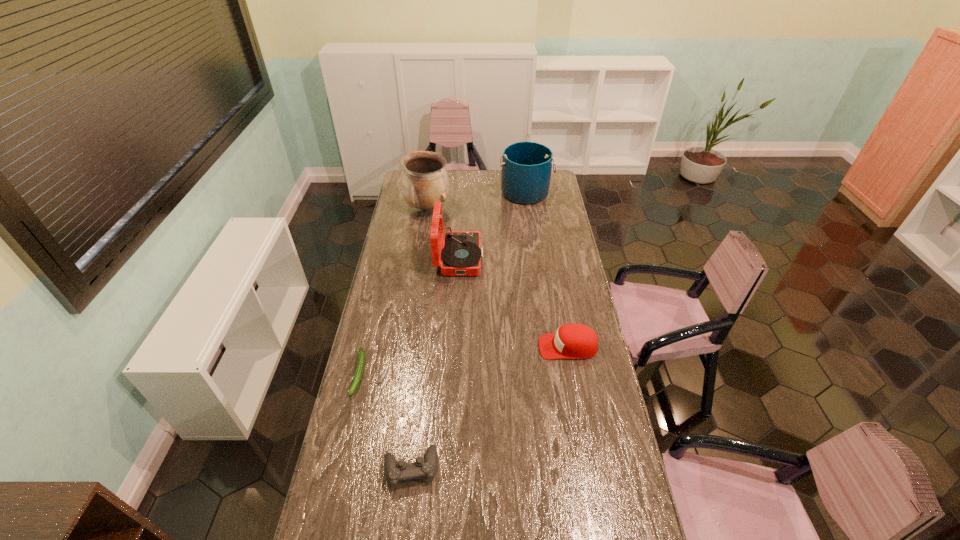
This screenshot has height=540, width=960. Identify the location of bucket positioned at the right edge. (526, 166).

Locate an element on the screen. baseball cap that is at the right edge is located at coordinates (571, 341).

This screenshot has width=960, height=540. In order to click on object that is at the far right corner in this screenshot , I will do `click(526, 166)`.

Where is `free location at the left edge`? free location at the left edge is located at coordinates (341, 537).

Locate an element on the screen. The width and height of the screenshot is (960, 540). free space at the right edge of the desktop is located at coordinates [x=625, y=512].

What are the coordinates of `empty location between the third farthest object and the control` in the screenshot? It's located at (435, 363).

You are a GUI agent. You are given a task and a screenshot of the screen. Output one action in this format:
    pyautogui.click(x=<x>, y=<y>)
    Task: Click on the vacant point located between the phonograph_record and the fourth tallest object
    
    Given the screenshot: What is the action you would take?
    [514, 302]

At what (x,y) coordinates should I click in order to perform the action: click on free spot between the urn and the bucket. Please return your answer as a coordinate pair (x, y). This screenshot has height=540, width=960. Looking at the image, I should click on (476, 201).

Image resolution: width=960 pixels, height=540 pixels. I want to click on unoccupied area between the urn and the second shortest object, so click(420, 338).

Find the location of a particular element. Image resolution: width=960 pixels, height=540 pixels. vacant space that is in between the leftmost object and the baseball cap is located at coordinates (464, 360).